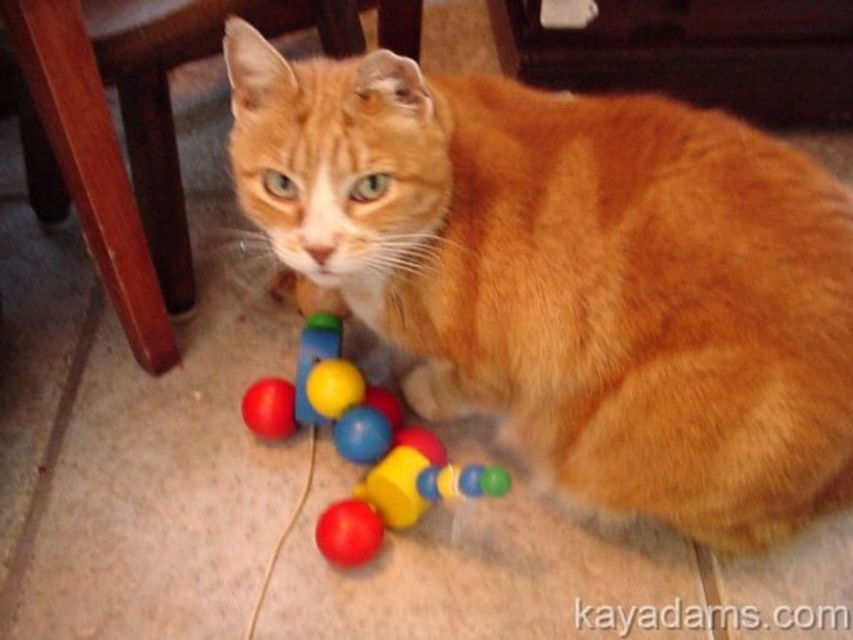
Question: Which object is closer to the camera taking this photo?

Choices:
 (A) smooth plastic toy at lower center
 (B) orange fur cat at center

Answer: (B)

Question: Considering the real-world distances, which object is closest to the rubber string at lower center?

Choices:
 (A) wooden chair at lower left
 (B) orange fur cat at center
 (C) smooth plastic toy at lower center

Answer: (C)

Question: Estimate the real-world distances between objects in this image. Which object is farther from the rubber string at lower center?

Choices:
 (A) wooden chair at lower left
 (B) smooth plastic toy at lower center

Answer: (A)

Question: Is wooden chair at lower left wider than rubber string at lower center?

Choices:
 (A) yes
 (B) no

Answer: (A)

Question: Does wooden chair at lower left have a lesser width compared to smooth plastic toy at lower center?

Choices:
 (A) yes
 (B) no

Answer: (B)

Question: From the image, what is the correct spatial relationship of orange fur cat at center in relation to smooth plastic toy at lower center?

Choices:
 (A) left
 (B) right

Answer: (B)